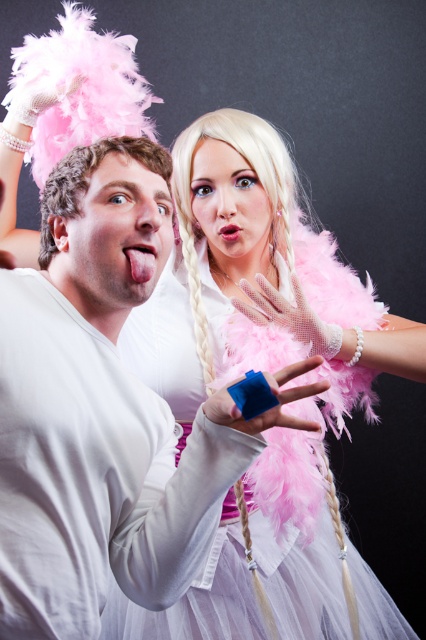
Between curly blonde wig at upper center and pink mesh glove at center, which one appears on the left side from the viewer's perspective?

curly blonde wig at upper center

Find the location of a particular element. This screenshot has width=426, height=640. curly blonde wig at upper center is located at coordinates pos(89,179).

How much distance is there between blonde feathered wig at upper center and blue plastic ring at center?

blonde feathered wig at upper center is 21.40 inches away from blue plastic ring at center.

Is point (279, 173) positioned before point (284, 426)?

No, it is not.

You are a GUI agent. You are given a task and a screenshot of the screen. Output one action in this format:
    pyautogui.click(x=<x>, y=<y>)
    Task: Click on the blonde feathered wig at upper center
    Image resolution: width=426 pixels, height=640 pixels.
    Given the screenshot: What is the action you would take?
    pyautogui.click(x=253, y=179)

Between blonde feathered wig at upper center and curly blonde wig at upper center, which one has more height?

With more height is blonde feathered wig at upper center.

Can you confirm if blonde feathered wig at upper center is positioned to the left of curly blonde wig at upper center?

In fact, blonde feathered wig at upper center is to the right of curly blonde wig at upper center.

The width and height of the screenshot is (426, 640). Find the location of `blonde feathered wig at upper center`. blonde feathered wig at upper center is located at coordinates (253, 179).